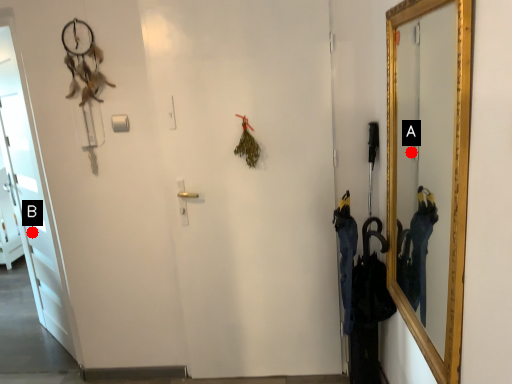
Question: Two points are circled on the image, labeled by A and B beside each circle. Which point is farther to the camera?

Choices:
 (A) A is further
 (B) B is further

Answer: (B)